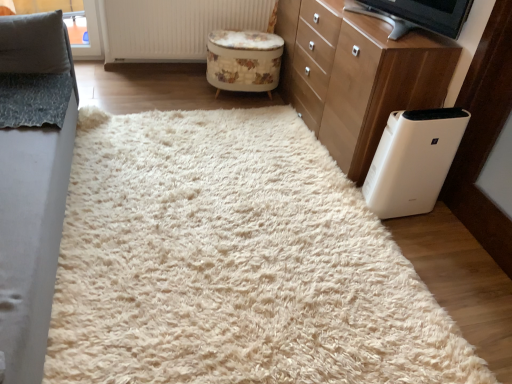
This screenshot has height=384, width=512. I want to click on white wood chest of drawers at right, so click(357, 75).

Where is `floral-patterned fabric stool at center`? Image resolution: width=512 pixels, height=384 pixels. floral-patterned fabric stool at center is located at coordinates (244, 60).

Describe the element at coordinates (32, 181) in the screenshot. I see `gray fabric couch at left` at that location.

Identify the location of gray fabric couch at left. (32, 181).

Locate an element on the screen. white plastic air purifier at lower right is located at coordinates (x=413, y=160).

Describe the element at coordinates (416, 14) in the screenshot. I see `white plastic tv at upper right` at that location.

Identify the location of white wood chest of drawers at right. (357, 75).

Is floral-patterned fabric stool at center aimed at gray fabric couch at left?

No, floral-patterned fabric stool at center is not oriented towards gray fabric couch at left.

Is gray fabric couch at left completely or partially inside floral-patterned fabric stool at center?

No, gray fabric couch at left is not inside floral-patterned fabric stool at center.

From a real-world perspective, which is physically below, floral-patterned fabric stool at center or gray fabric couch at left?

floral-patterned fabric stool at center is physically lower.

Is floral-patterned fabric stool at center to the right of gray fabric couch at left from the viewer's perspective?

Indeed, floral-patterned fabric stool at center is positioned on the right side of gray fabric couch at left.

Where is `pillow behind the white plastic tv at upper right`? The height and width of the screenshot is (384, 512). pillow behind the white plastic tv at upper right is located at coordinates (35, 44).

Is white plastic tv at upper right far from gray fabric pillow at upper left?

Yes.

Is gray fabric pillow at upper left inside white plastic tv at upper right?

No.

Looking at this image, from the image's perspective, which object appears higher, gray fabric pillow at upper left or white plastic tv at upper right?

white plastic tv at upper right, from the image's perspective.

Considering the positions of objects gray fabric pillow at upper left and white plastic tv at upper right in the image provided, who is more to the right, gray fabric pillow at upper left or white plastic tv at upper right?

Positioned to the right is white plastic tv at upper right.

Could white plastic tv at upper right be considered to be inside gray fabric pillow at upper left?

No, white plastic tv at upper right is not a part of gray fabric pillow at upper left.

Considering the relative sizes of gray fabric pillow at upper left and white plastic tv at upper right in the image provided, is gray fabric pillow at upper left thinner than white plastic tv at upper right?

Yes, gray fabric pillow at upper left is thinner than white plastic tv at upper right.

Is white plastic tv at upper right positioned beyond the bounds of white fluffy rug at center?

white plastic tv at upper right is positioned outside white fluffy rug at center.

Can you tell me how much white plastic tv at upper right and white fluffy rug at center differ in facing direction?

There is a 110-degree angle between the facing directions of white plastic tv at upper right and white fluffy rug at center.

Who is taller, white plastic tv at upper right or white fluffy rug at center?

Standing taller between the two is white plastic tv at upper right.

From a real-world perspective, is white plastic tv at upper right on top of white fluffy rug at center?

Indeed, from a real-world perspective, white plastic tv at upper right stands above white fluffy rug at center.

From a real-world perspective, which is physically above, white fluffy rug at center or white plastic air purifier at lower right?

white plastic air purifier at lower right.

Can you confirm if white fluffy rug at center is taller than white plastic air purifier at lower right?

Incorrect, the height of white fluffy rug at center is not larger of that of white plastic air purifier at lower right.

Is white fluffy rug at center turned away from white plastic air purifier at lower right?

That's not correct — white fluffy rug at center is not looking away from white plastic air purifier at lower right.

Between point (129, 276) and point (446, 119), which one is positioned in front?

The point (129, 276) is in front.

The width and height of the screenshot is (512, 384). I want to click on stool below the white wood chest of drawers at right (from a real-world perspective), so point(244,60).

From a real-world perspective, who is located lower, floral-patterned fabric stool at center or white wood chest of drawers at right?

From a 3D spatial view, floral-patterned fabric stool at center is below.

Looking at their sizes, would you say floral-patterned fabric stool at center is wider or thinner than white wood chest of drawers at right?

In the image, floral-patterned fabric stool at center appears to be more narrow than white wood chest of drawers at right.

How distant is floral-patterned fabric stool at center from white wood chest of drawers at right?

27.26 inches.

Is gray fabric couch at left positioned with its back to white wood chest of drawers at right?

No, gray fabric couch at left is not facing the opposite direction of white wood chest of drawers at right.

Is point (32, 278) closer to camera compared to point (381, 38)?

Yes, point (32, 278) is in front of point (381, 38).

From a real-world perspective, which is physically below, gray fabric couch at left or white wood chest of drawers at right?

white wood chest of drawers at right.

Is white wood chest of drawers at right located within gray fabric couch at left?

No, white wood chest of drawers at right is not surrounded by gray fabric couch at left.

Image resolution: width=512 pixels, height=384 pixels. Find the location of `stool below the gray fabric couch at left (from a real-world perspective)`. stool below the gray fabric couch at left (from a real-world perspective) is located at coordinates [x=244, y=60].

The height and width of the screenshot is (384, 512). Find the location of `electronic that is above the gray fabric pillow at upper left (from a real-world perspective)`. electronic that is above the gray fabric pillow at upper left (from a real-world perspective) is located at coordinates (416, 14).

Based on their spatial positions, is floral-patterned fabric stool at center or white plastic air purifier at lower right further from white plastic tv at upper right?

floral-patterned fabric stool at center.

Which object lies nearer to the anchor point white wood chest of drawers at right, white plastic air purifier at lower right or floral-patterned fabric stool at center?

Among the two, white plastic air purifier at lower right is located nearer to white wood chest of drawers at right.

Based on their spatial positions, is gray fabric pillow at upper left or floral-patterned fabric stool at center closer to white textured radiator at upper center?

The object closer to white textured radiator at upper center is floral-patterned fabric stool at center.

Based on their spatial positions, is white fluffy rug at center or white plastic tv at upper right further from white textured radiator at upper center?

white fluffy rug at center is further to white textured radiator at upper center.

Estimate the real-world distances between objects in this image. Which object is further from gray fabric couch at left, floral-patterned fabric stool at center or gray fabric pillow at upper left?

floral-patterned fabric stool at center is further to gray fabric couch at left.

Which object lies nearer to the anchor point gray fabric pillow at upper left, white wood chest of drawers at right or gray fabric couch at left?

Based on the image, gray fabric couch at left appears to be nearer to gray fabric pillow at upper left.

Based on their spatial positions, is white fluffy rug at center or white plastic air purifier at lower right further from floral-patterned fabric stool at center?

Among the two, white plastic air purifier at lower right is located further to floral-patterned fabric stool at center.

Looking at the image, which one is located closer to white plastic tv at upper right, white fluffy rug at center or white textured radiator at upper center?

white fluffy rug at center.

Locate an element on the screen. This screenshot has height=384, width=512. pillow between gray fabric couch at left and floral-patterned fabric stool at center in the front-back direction is located at coordinates (35, 44).

Identify the location of furniture situated between gray fabric pillow at upper left and white plastic air purifier at lower right from left to right. The width and height of the screenshot is (512, 384). (32, 181).

Locate an element on the screen. Image resolution: width=512 pixels, height=384 pixels. the chest of drawers located between white plastic air purifier at lower right and floral-patterned fabric stool at center in the depth direction is located at coordinates (357, 75).

Find the location of a particular element. The image size is (512, 384). home appliance located between white fluffy rug at center and floral-patterned fabric stool at center in the depth direction is located at coordinates (413, 160).